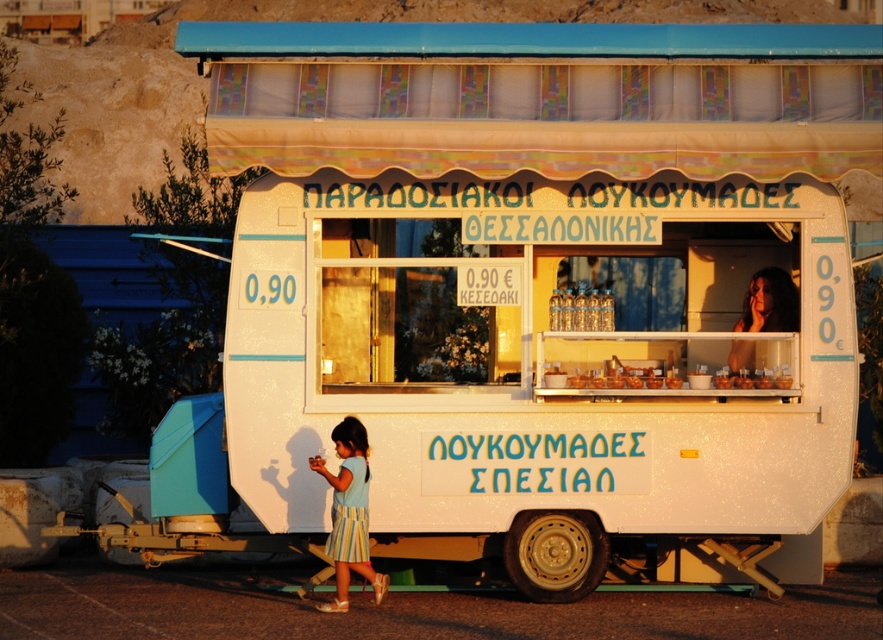
Looking at this image, you are a customer at the Greek food stall and see a light blue fabric dress at lower center and translucent glass jars at center. Which item is more to the left?

The light blue fabric dress at lower center is more to the left than the translucent glass jars at center.

You are a customer at the food stall and want to order the traditional ouzo. The smooth brown hair at upper right is part of a sign. Can you see the translucent glass jars at center from where you are standing?

The smooth brown hair at upper right is positioned over the translucent glass jars at center, so the jars might be partially obscured by the sign. You may need to move to a different angle to see them clearly.